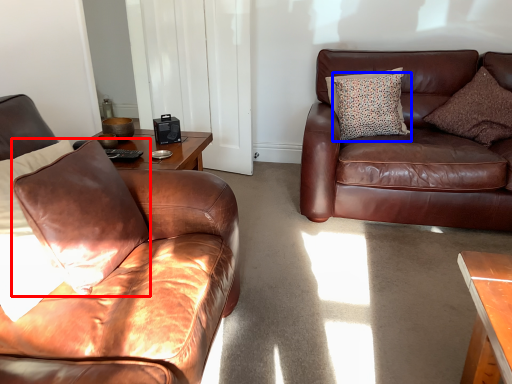
Question: Which object appears farthest to the camera in this image, pillow (highlighted by a red box) or pillow (highlighted by a blue box)?

Choices:
 (A) pillow
 (B) pillow

Answer: (B)